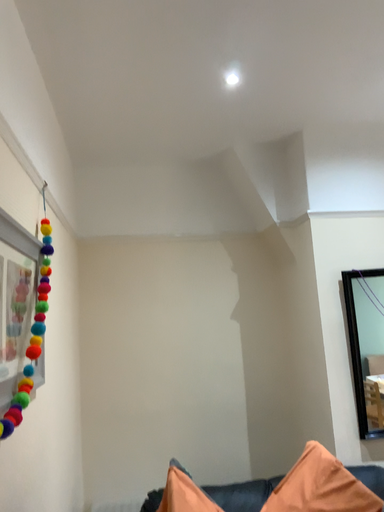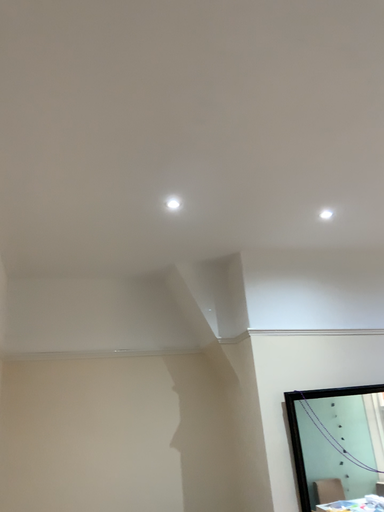
Question: Which way did the camera rotate in the video?

Choices:
 (A) rotated right
 (B) rotated left

Answer: (A)